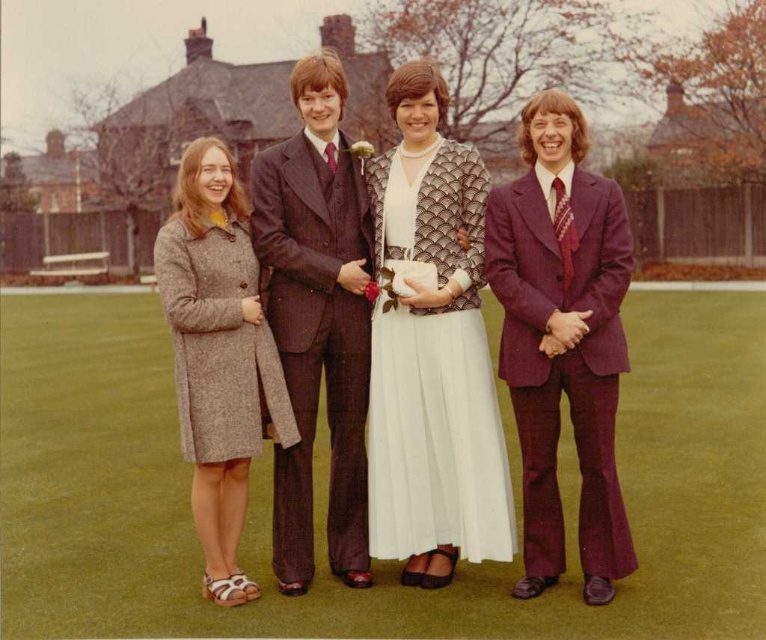
Question: Does brown pinstripe suit at center have a lesser width compared to gray wool coat at left?

Choices:
 (A) no
 (B) yes

Answer: (B)

Question: Which is nearer to the maroon textured suit at right?

Choices:
 (A) white pleated dress at center
 (B) matte brown coat at left

Answer: (B)

Question: Can you confirm if maroon textured suit at right is positioned above brown pinstripe suit at center?

Choices:
 (A) yes
 (B) no

Answer: (A)

Question: Is matte brown coat at left positioned behind white pleated dress at center?

Choices:
 (A) yes
 (B) no

Answer: (B)

Question: Which object is the farthest from the gray wool coat at left?

Choices:
 (A) matte brown coat at left
 (B) maroon textured suit at right

Answer: (B)

Question: Estimate the real-world distances between objects in this image. Which object is closer to the matte brown coat at left?

Choices:
 (A) gray wool coat at left
 (B) white pleated dress at center

Answer: (A)